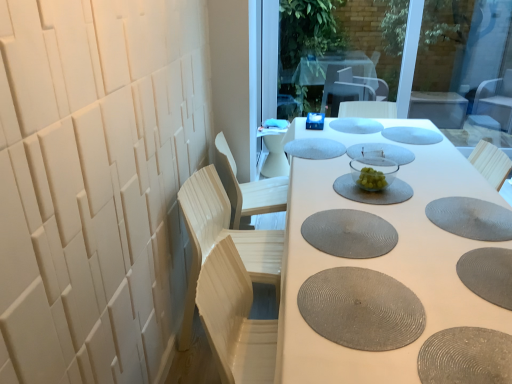
Image resolution: width=512 pixels, height=384 pixels. I want to click on vacant space behind gray textured placemat at lower right, the eighth manhole cover in the back-to-front sequence, so click(463, 225).